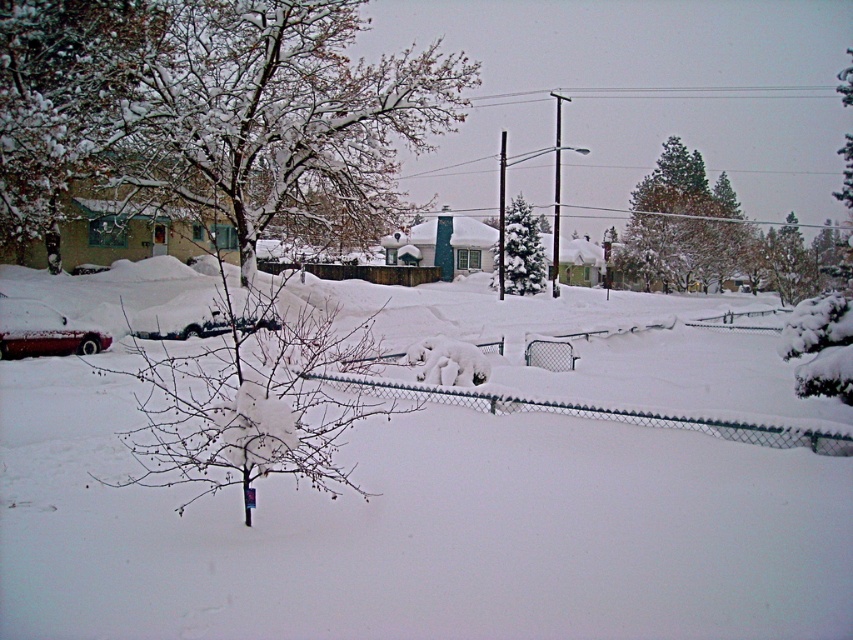
At what (x,y) coordinates should I click in order to perform the action: click on snow-covered tree at center. Please return your answer as a coordinate pair (x, y). Looking at the image, I should click on (213, 109).

Can you confirm if snow-covered tree at center is positioned to the right of snow-covered evergreen at center?

No, snow-covered tree at center is not to the right of snow-covered evergreen at center.

This screenshot has width=853, height=640. Find the location of `snow-covered tree at center`. snow-covered tree at center is located at coordinates (213, 109).

Is point (65, 320) closer to camera compared to point (498, 225)?

Yes.

Does shiny red car at left have a greater height compared to smooth wood utility pole at center?

Incorrect, shiny red car at left's height is not larger of smooth wood utility pole at center's.

What do you see at coordinates (42, 332) in the screenshot? I see `shiny red car at left` at bounding box center [42, 332].

You are a GUI agent. You are given a task and a screenshot of the screen. Output one action in this format:
    pyautogui.click(x=<x>, y=<y>)
    Task: Click on the shiny red car at left
    
    Given the screenshot: What is the action you would take?
    pyautogui.click(x=42, y=332)

Between snow-covered tree at center and shiny red car at left, which one is positioned higher?

Positioned higher is snow-covered tree at center.

Does snow-covered tree at center come in front of shiny red car at left?

Yes, it is.

Measure the distance between snow-covered tree at center and camera.

snow-covered tree at center and camera are 6.75 meters apart.

This screenshot has width=853, height=640. What are the coordinates of `snow-covered tree at center` in the screenshot? It's located at (213, 109).